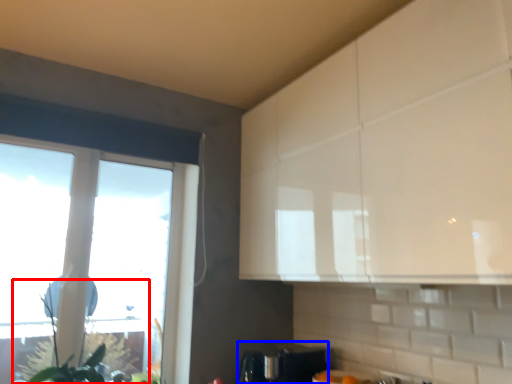
Question: Which object is closer to the camera taking this photo, plant (highlighted by a red box) or appliance (highlighted by a blue box)?

Choices:
 (A) plant
 (B) appliance

Answer: (A)